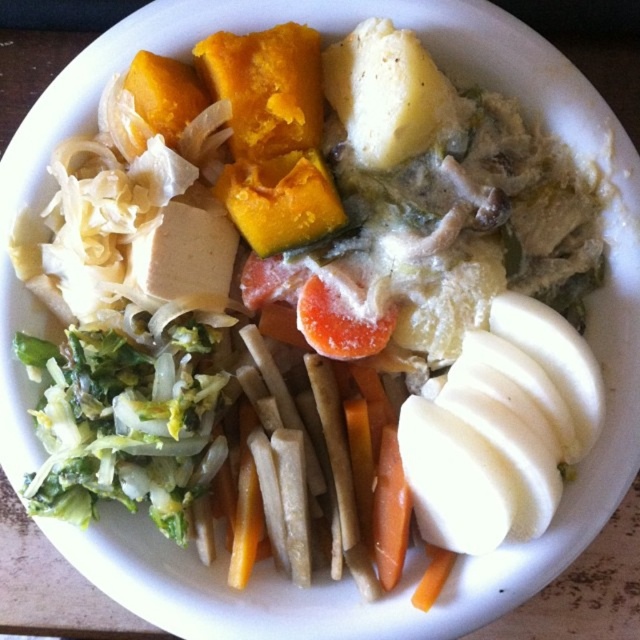
You are a food critic evaluating this vegetarian plate. You notice the yellow matte potato at upper center and the orange smooth carrot at center. Which of these two items is bigger in size?

The yellow matte potato at upper center is larger in size than the orange smooth carrot at center.

You are a food critic sitting at a table with this plate of food in front of you. You want to pick up the yellow matte potato at upper center and the orange smooth carrot at center. Which one would you need to move first to reach the one behind?

The yellow matte potato at upper center is in front of the orange smooth carrot at center, so you would need to move the yellow matte potato at upper center first to reach the orange smooth carrot at center.